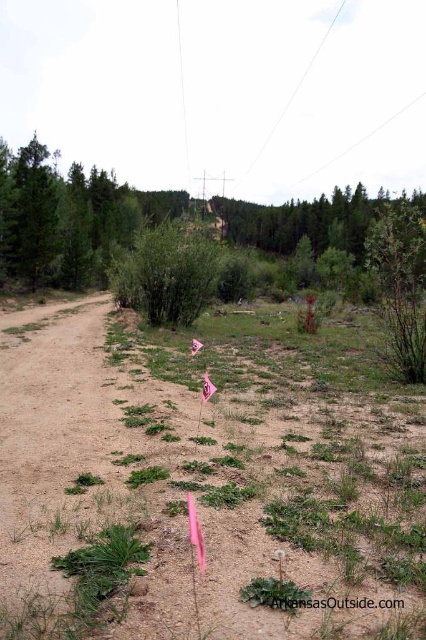
Who is higher up, dull brown dirt at center or green leafy bush at center?

green leafy bush at center is higher up.

The height and width of the screenshot is (640, 426). In order to click on dull brown dirt at center in this screenshot , I will do `click(204, 483)`.